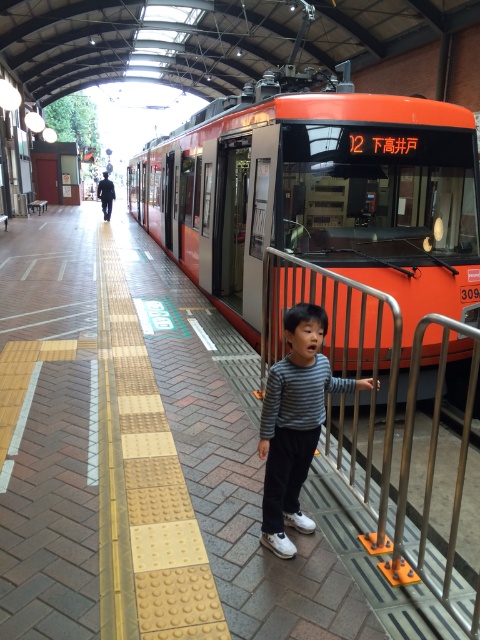
Question: Is orange glossy tram at center thinner than striped fabric child at center?

Choices:
 (A) yes
 (B) no

Answer: (B)

Question: Which point is farther to the camera?

Choices:
 (A) striped fabric child at center
 (B) orange glossy tram at center

Answer: (B)

Question: Does orange glossy tram at center come behind silver metallic rail at center?

Choices:
 (A) no
 (B) yes

Answer: (B)

Question: Can you confirm if silver metallic rail at center is positioned to the left of striped fabric child at center?

Choices:
 (A) no
 (B) yes

Answer: (A)

Question: Among these points, which one is farthest from the camera?

Choices:
 (A) (283, 196)
 (B) (266, 419)
 (C) (352, 468)

Answer: (A)

Question: Based on their relative distances, which object is farther from the orange glossy tram at center?

Choices:
 (A) striped fabric child at center
 (B) silver metallic rail at center

Answer: (A)